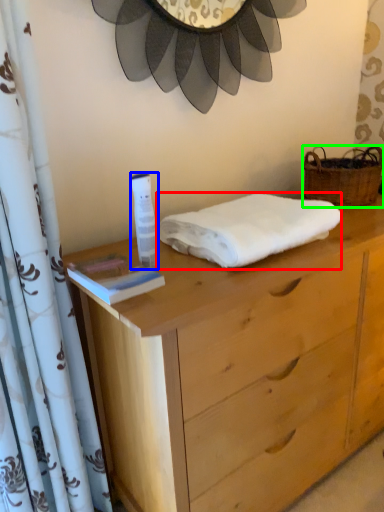
Question: Estimate the real-world distances between objects in this image. Which object is farther from towel (highlighted by a red box), toiletry (highlighted by a blue box) or picnic basket (highlighted by a green box)?

Choices:
 (A) toiletry
 (B) picnic basket

Answer: (B)